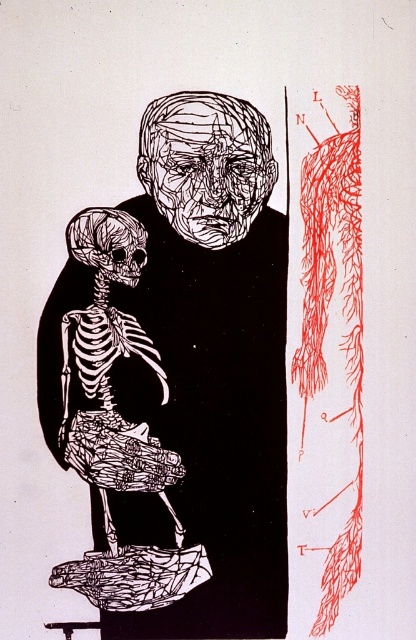
Does white line art face at upper center have a lesser width compared to white bone-like skeleton at left?

Incorrect, white line art face at upper center's width is not less than white bone-like skeleton at left's.

Which is in front, point (217, 116) or point (83, 428)?

Point (217, 116)

Where is `white line art face at upper center`? white line art face at upper center is located at coordinates (178, 381).